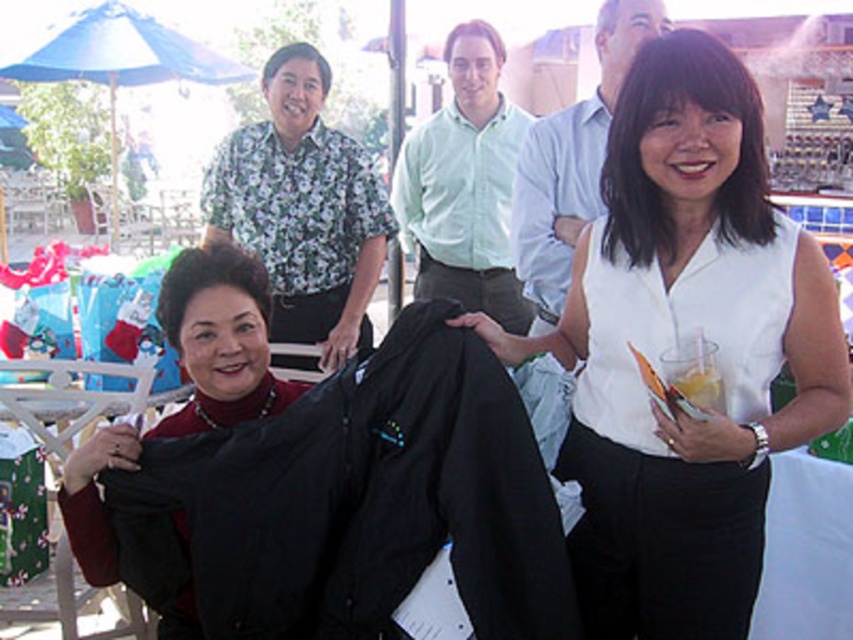
Question: Can you confirm if white matte shirt at center is positioned below light blue cotton shirt at upper center?

Choices:
 (A) no
 (B) yes

Answer: (B)

Question: Can you confirm if light blue cotton shirt at upper center is positioned to the right of blue fabric umbrella at upper left?

Choices:
 (A) yes
 (B) no

Answer: (A)

Question: Which point appears farthest from the camera in this image?

Choices:
 (A) (693, 144)
 (B) (76, 52)
 (C) (402, 212)

Answer: (B)

Question: Can you confirm if metallic white chair at lower left is positioned to the right of translucent glass drink at right?

Choices:
 (A) yes
 (B) no

Answer: (B)

Question: Which object is the closest to the translucent glass drink at right?

Choices:
 (A) matte black jacket at center
 (B) metallic white chair at lower left
 (C) light green cotton shirt at center
 (D) blue fabric umbrella at upper left

Answer: (A)

Question: Which of the following is the closest to the observer?

Choices:
 (A) (305, 557)
 (B) (497, 228)
 (C) (109, 13)

Answer: (A)